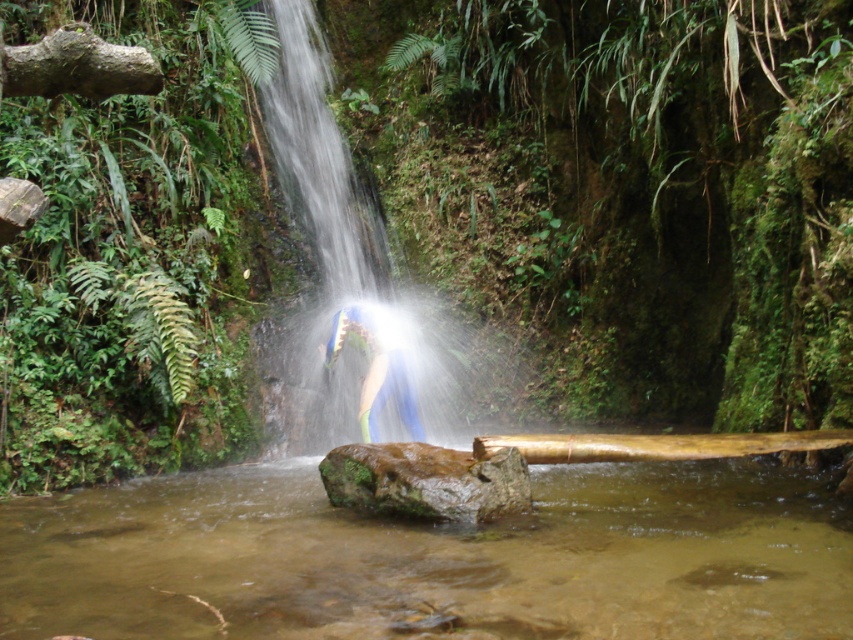
You are standing at the edge of the pool and want to jump into the water. The clear water stream at center and the green mossy rock at center are in your line of sight. Which object will you see first as you look forward?

The clear water stream at center is in front of the green mossy rock at center, so you will see the clear water stream at center first.

You are standing near the waterfall and want to determine which part of the water is shallower. Based on the scene, which area between the clear water stream at center and the translucent water at center would you consider shallower?

The clear water stream at center has a lesser height compared to the translucent water at center, indicating it is shallower.